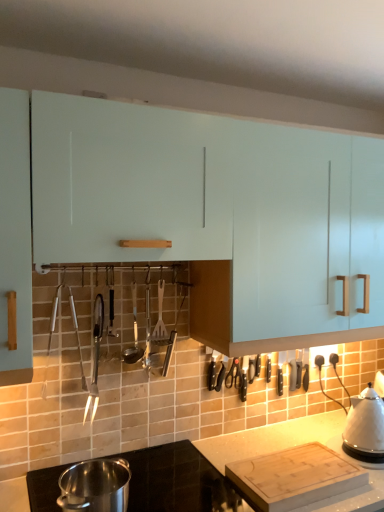
Identify the location of free space behind white glossy kettle at right, the 2th kitchen appliance in the left-to-right sequence. The width and height of the screenshot is (384, 512). (324, 435).